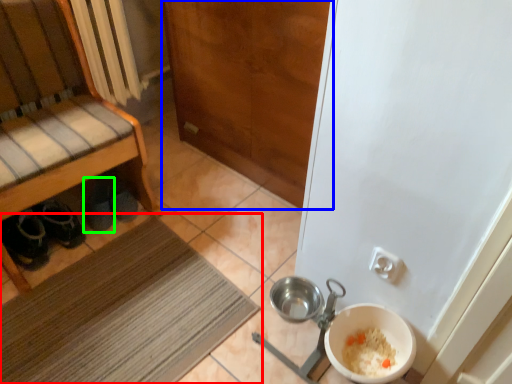
Question: Which object is the closest to the mat (highlighted by a red box)? Choose among these: door (highlighted by a blue box) or footwear (highlighted by a green box).

Choices:
 (A) door
 (B) footwear

Answer: (B)